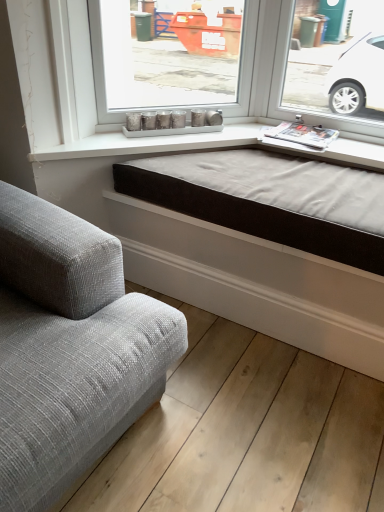
Question: Do you think brown fabric bed frame at center is within textured gray fabric couch at lower left, or outside of it?

Choices:
 (A) inside
 (B) outside

Answer: (B)

Question: Is point (228, 196) closer or farther from the camera than point (162, 353)?

Choices:
 (A) farther
 (B) closer

Answer: (A)

Question: From a real-world perspective, is brown fabric bed frame at center physically located above or below textured gray fabric couch at lower left?

Choices:
 (A) below
 (B) above

Answer: (B)

Question: Is textured gray fabric couch at lower left taller or shorter than brown fabric bed frame at center?

Choices:
 (A) tall
 (B) short

Answer: (A)

Question: From a real-world perspective, relative to brown fabric bed frame at center, is textured gray fabric couch at lower left vertically above or below?

Choices:
 (A) below
 (B) above

Answer: (A)

Question: From the image's perspective, is textured gray fabric couch at lower left positioned above or below brown fabric bed frame at center?

Choices:
 (A) below
 (B) above

Answer: (A)

Question: Considering the positions of point 82,309 and point 349,241, is point 82,309 closer or farther from the camera than point 349,241?

Choices:
 (A) farther
 (B) closer

Answer: (B)